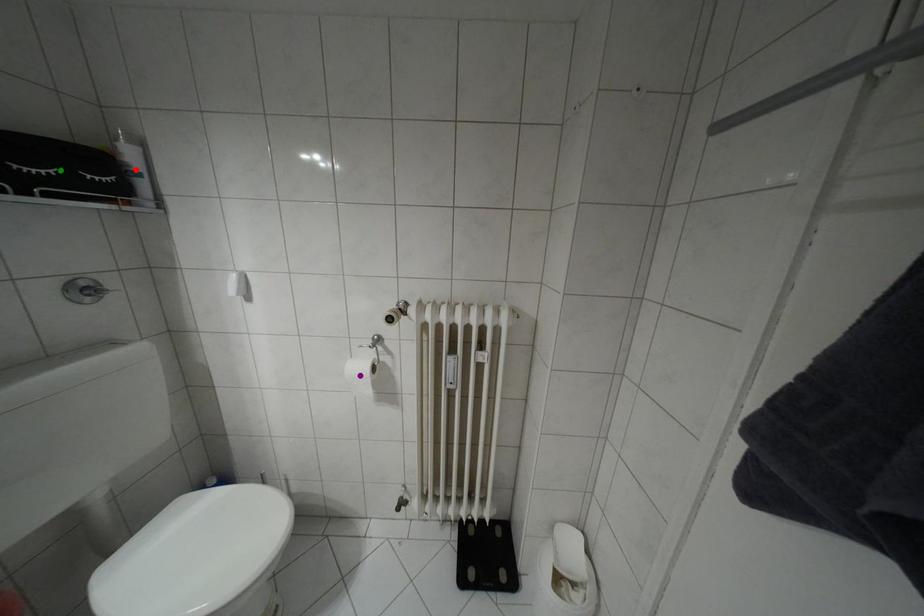
Order these from nearest to farthest:
green point | red point | purple point

green point < red point < purple point